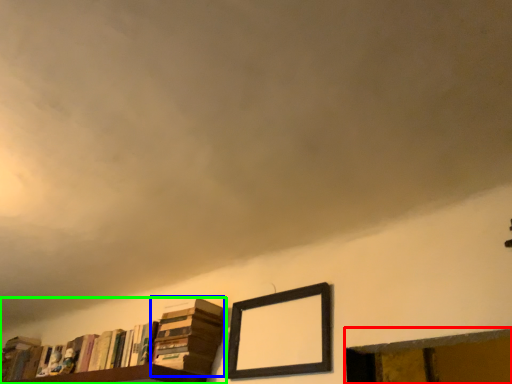
Question: Considering the real-world distances, which object is closest to window frame (highlighted by a red box)? book (highlighted by a blue box) or book (highlighted by a green box).

Choices:
 (A) book
 (B) book

Answer: (A)